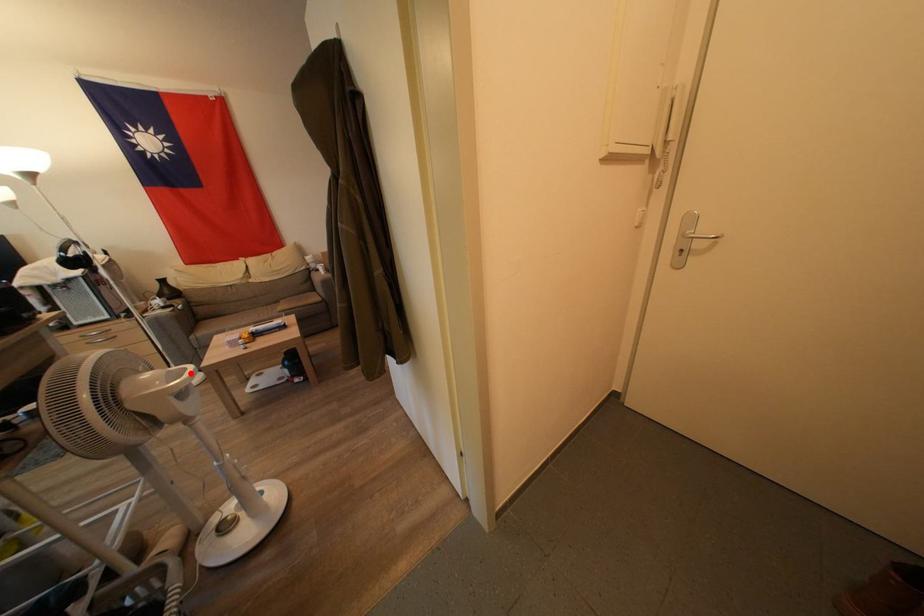
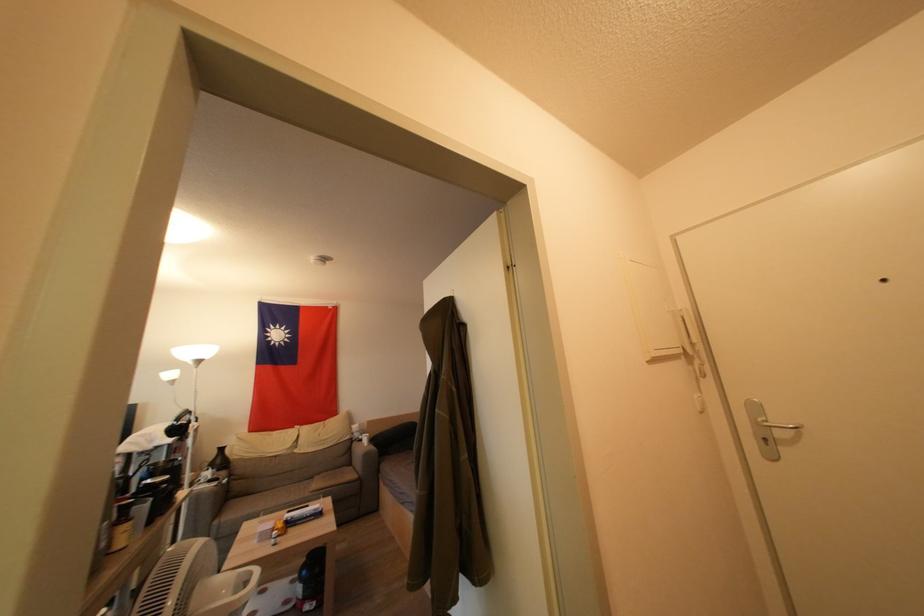
Question: I am providing you with two images of the same scene from different viewpoints. A red point is shown in image1. For the corresponding object point in image2, is it positioned nearer or farther from the camera?

Choices:
 (A) Nearer
 (B) Farther

Answer: (B)